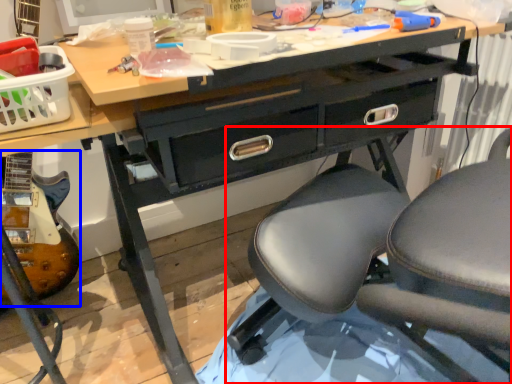
Question: Which point is closer to the camera, chair (highlighted by a red box) or equipment (highlighted by a blue box)?

Choices:
 (A) chair
 (B) equipment

Answer: (A)